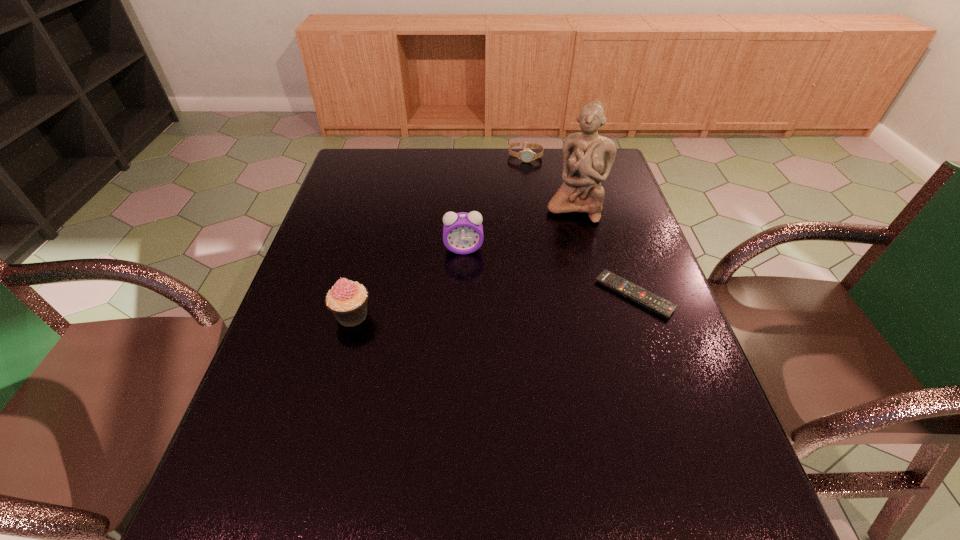
Where is `the leftmost object`? The width and height of the screenshot is (960, 540). the leftmost object is located at coordinates (347, 300).

Where is `the shortest object`? The width and height of the screenshot is (960, 540). the shortest object is located at coordinates (662, 307).

Find the location of `the third nearest object`. the third nearest object is located at coordinates (462, 232).

Find the location of a particular element. the second object from left to right is located at coordinates (462, 232).

The width and height of the screenshot is (960, 540). I want to click on the farthest object, so click(526, 155).

I want to click on the second shortest object, so click(526, 155).

Locate an element on the screen. The height and width of the screenshot is (540, 960). the tallest object is located at coordinates (587, 157).

Find the location of a particular element. figurine is located at coordinates (587, 157).

You are a GUI agent. You are given a task and a screenshot of the screen. Output one action in this format:
    pyautogui.click(x=<x>, y=<y>)
    Task: Click on the vacant space located on the right of the leftmost object
    
    Given the screenshot: What is the action you would take?
    pyautogui.click(x=403, y=315)

Where is `free space located on the left of the remote control`? free space located on the left of the remote control is located at coordinates (504, 295).